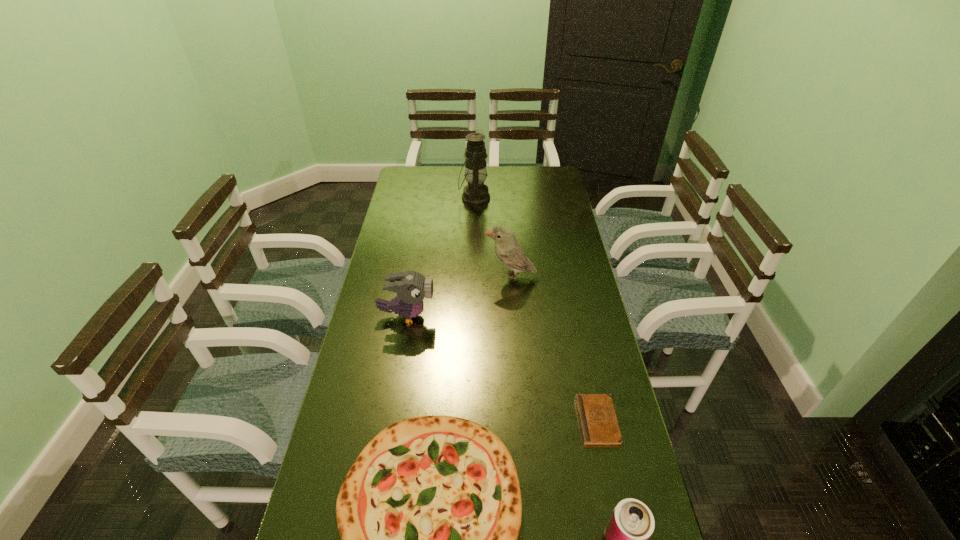
Where is `free point at the right edge`? The image size is (960, 540). free point at the right edge is located at coordinates (561, 374).

In the image, there is a desktop. Where is `vacant space at the far left corner`? vacant space at the far left corner is located at coordinates (417, 167).

In the image, there is a desktop. What are the coordinates of `free space at the far right corner` in the screenshot? It's located at (534, 178).

Identify the location of vacant area that lies between the fifth shortest object and the shortest object. (554, 349).

This screenshot has width=960, height=540. What are the coordinates of `free space between the second farthest object and the nearer bird` in the screenshot? It's located at (458, 296).

You are a GUI agent. You are given a task and a screenshot of the screen. Output one action in this format:
    pyautogui.click(x=<x>, y=<y>)
    Task: Click on the vacant point located between the taller bird and the shortest object
    
    Given the screenshot: What is the action you would take?
    pyautogui.click(x=554, y=349)

You are a GUI agent. You are given a task and a screenshot of the screen. Output one action in this format:
    pyautogui.click(x=<x>, y=<y>)
    Task: Click on the free space between the third tallest object and the farthest object
    This screenshot has height=540, width=960.
    Given the screenshot: What is the action you would take?
    pyautogui.click(x=441, y=257)

The width and height of the screenshot is (960, 540). In order to click on free space that is in between the right bird and the shortest object in this screenshot , I will do `click(554, 349)`.

Identify which object is located as the fifth nearest to the can. Please provide its 2D coordinates. Your answer should be formatted as a tuple, i.e. [(x, y)], where the tuple contains the x and y coordinates of a point satisfying the conditions above.

[(476, 193)]

This screenshot has height=540, width=960. Identify the location of object that ranks as the third closest to the fifth tallest object. (411, 287).